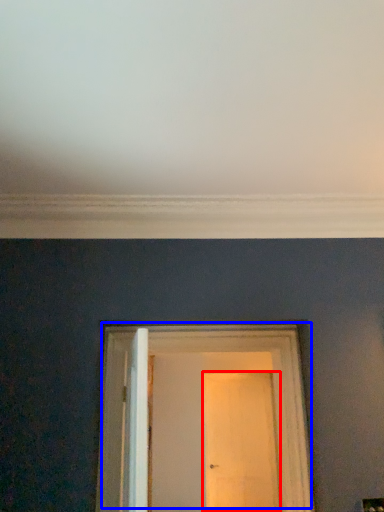
Question: Which object appears farthest to the camera in this image, door (highlighted by a red box) or door (highlighted by a blue box)?

Choices:
 (A) door
 (B) door

Answer: (A)